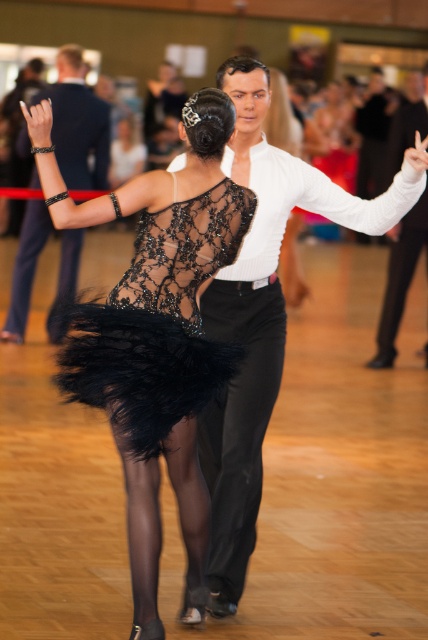
You are a photographer at the dance event and want to capture a full body shot of both the black lace dress at center and the white smooth shirt at upper center. Based on their positions and sizes, which one should you focus on to ensure both are in frame without cropping?

The black lace dress at center is taller than the white smooth shirt at upper center, so focusing on the black lace dress at center will ensure both are in frame without cropping.

From the picture: You are a photographer at a ballroom event and want to capture a photo of the black lace dress at center and the white smooth shirt at upper center. Which one is more to the left in the image?

The black lace dress at center is more to the left in the image as it is positioned on the left side of the white smooth shirt at upper center.

Looking at this image, you are a photographer at the dance event. You want to capture a photo of the dancers. Which dress, the black lace dress at center or the lacy black dress at center, is positioned lower in the image?

The black lace dress at center is positioned lower than the lacy black dress at center in the image.